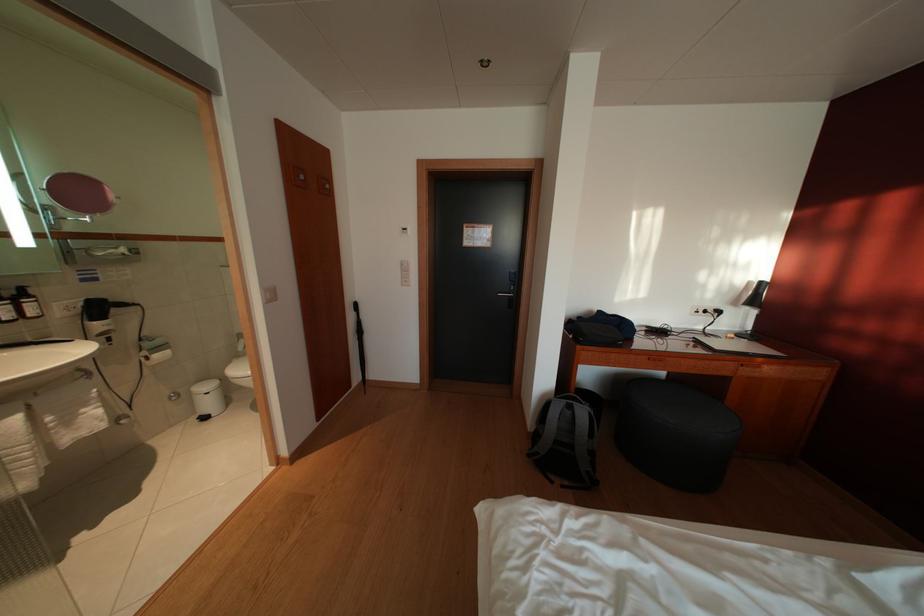
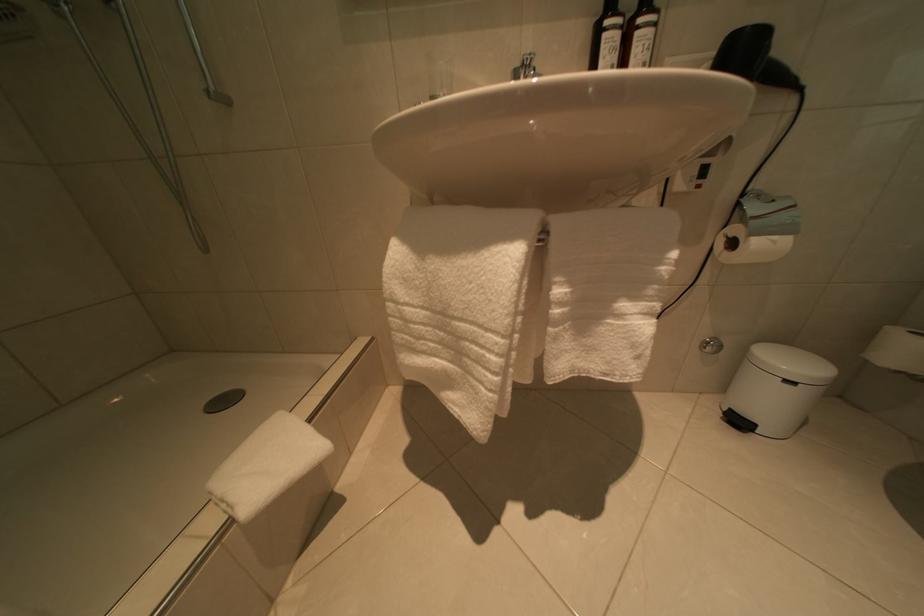
Where in the second image is the point corresponding to pixel 213 424 from the first image?

(746, 428)